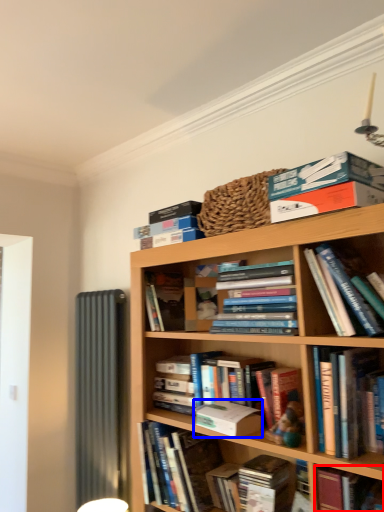
Question: Among these objects, which one is farthest to the camera, book (highlighted by a red box) or paperback book (highlighted by a blue box)?

Choices:
 (A) book
 (B) paperback book

Answer: (B)